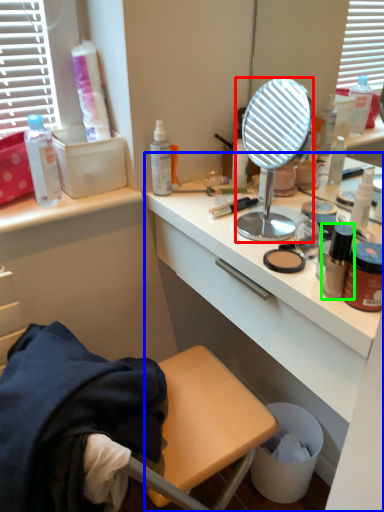
Question: Estimate the real-world distances between objects in this image. Which object is farther from mirror (highlighted by a red box), desk (highlighted by a blue box) or bottle (highlighted by a green box)?

Choices:
 (A) desk
 (B) bottle

Answer: (B)